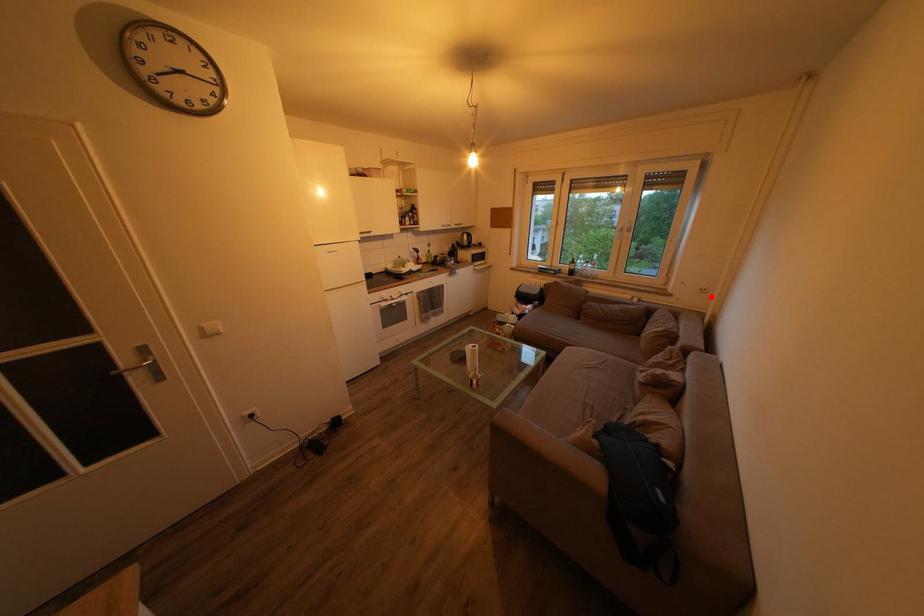
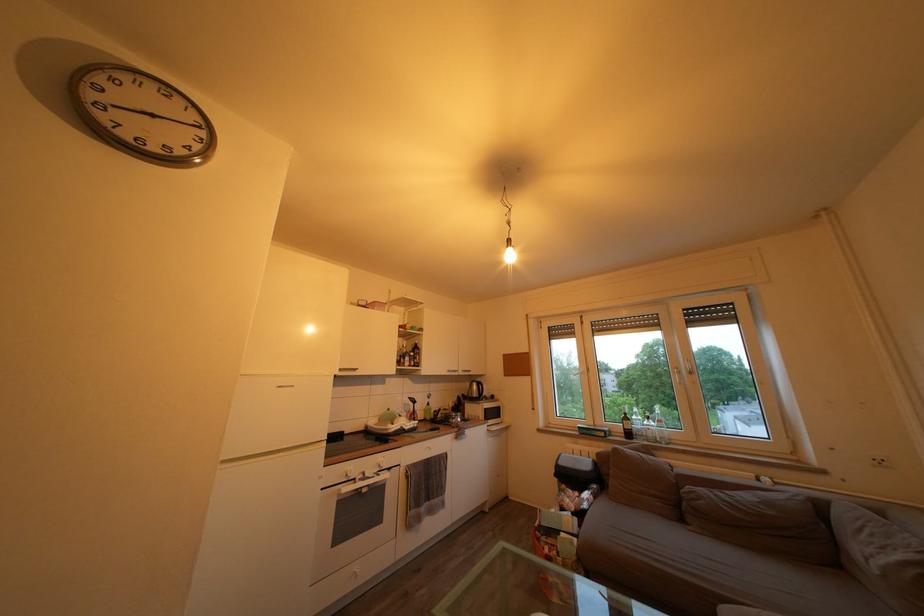
Locate, in the second image, the point that corresponds to the highlighted location in the first image.

(889, 468)